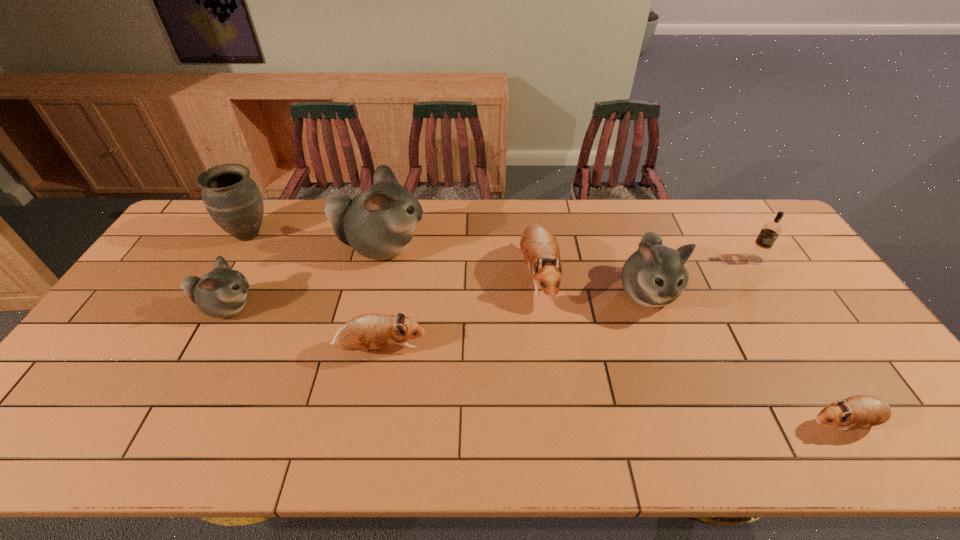
At what (x,y) coordinates should I click in order to perform the action: click on vacant space situated 0.280m at the face of the second shortest object. Please return your answer as a coordinate pair (x, y). The height and width of the screenshot is (540, 960). Looking at the image, I should click on (532, 349).

What are the coordinates of `vacant space located at the face of the smallest brown hamster` in the screenshot? It's located at (780, 423).

The image size is (960, 540). What are the coordinates of `free spot located 0.250m at the face of the smallest brown hamster` in the screenshot? It's located at (697, 423).

The width and height of the screenshot is (960, 540). In order to click on vacant space located at the face of the smallest brown hamster in this screenshot , I will do click(x=771, y=423).

You are a GUI agent. You are given a task and a screenshot of the screen. Output one action in this format:
    pyautogui.click(x=<x>, y=<y>)
    Task: Click on the hamster situated at the far edge
    The height and width of the screenshot is (540, 960).
    Given the screenshot: What is the action you would take?
    pyautogui.click(x=378, y=223)

At what (x,y) coordinates should I click in order to perform the action: click on urn situated at the far edge. Please return your answer as a coordinate pair (x, y). Looking at the image, I should click on tap(233, 200).

Find the location of `object that is at the near edge`. object that is at the near edge is located at coordinates (862, 410).

Find the location of `object that is at the left edge`. object that is at the left edge is located at coordinates (233, 200).

Locate an element on the screen. This screenshot has width=960, height=540. vodka that is at the right edge is located at coordinates (770, 231).

You are a GUI agent. You are given a task and a screenshot of the screen. Output one action in this format:
    pyautogui.click(x=<x>, y=<y>)
    Task: Click on the hamster at the right edge
    The height and width of the screenshot is (540, 960).
    Given the screenshot: What is the action you would take?
    pyautogui.click(x=862, y=410)